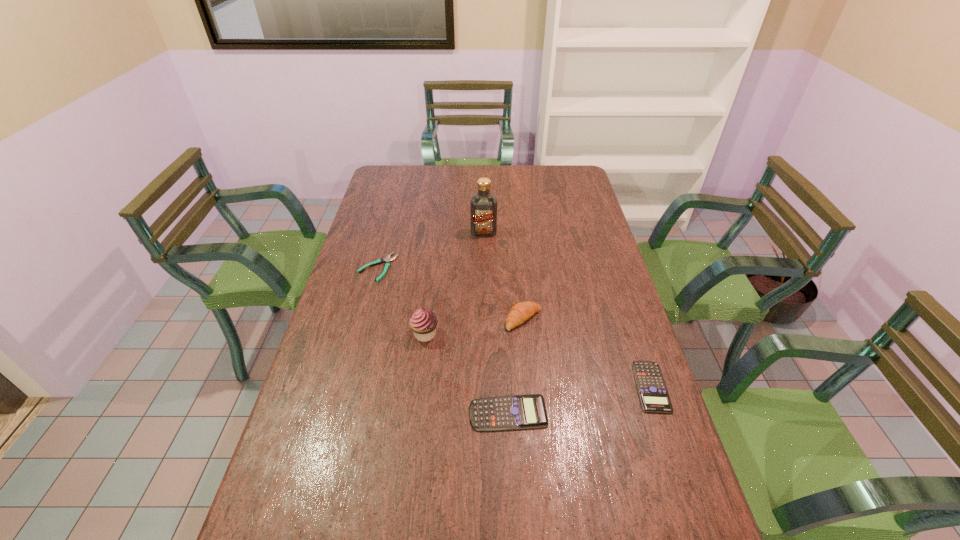
You are a GUI agent. You are given a task and a screenshot of the screen. Output one action in this format:
    pyautogui.click(x=<x>, y=<y>)
    Task: Click on the free region located on the front of the taller calculator
    This screenshot has width=960, height=540.
    Given the screenshot: What is the action you would take?
    pyautogui.click(x=511, y=460)

You are a GUI agent. You are given a task and a screenshot of the screen. Output one action in this format:
    pyautogui.click(x=<x>, y=<y>)
    Task: Click on the vacant area located on the back of the right calculator
    
    Given the screenshot: What is the action you would take?
    tap(625, 310)

This screenshot has height=540, width=960. What are the coordinates of `free space located on the front-facing side of the tallest object` in the screenshot? It's located at (484, 258).

Locate an element on the screen. The height and width of the screenshot is (540, 960). free location located 0.310m on the back of the crescent roll is located at coordinates (516, 246).

Where is `vacant space situated 0.260m on the right of the second tallest object`? The image size is (960, 540). vacant space situated 0.260m on the right of the second tallest object is located at coordinates (526, 334).

I want to click on free space located 0.100m on the front of the second farthest object, so click(368, 304).

The width and height of the screenshot is (960, 540). I want to click on object present at the left edge, so click(x=387, y=260).

The width and height of the screenshot is (960, 540). Find the location of `object located at the right edge`. object located at the right edge is located at coordinates (653, 394).

Identify the location of vacant space at the far edge of the desktop. The image size is (960, 540). (538, 188).

In the image, there is a desktop. Identify the location of vacant space at the near edge. (558, 511).